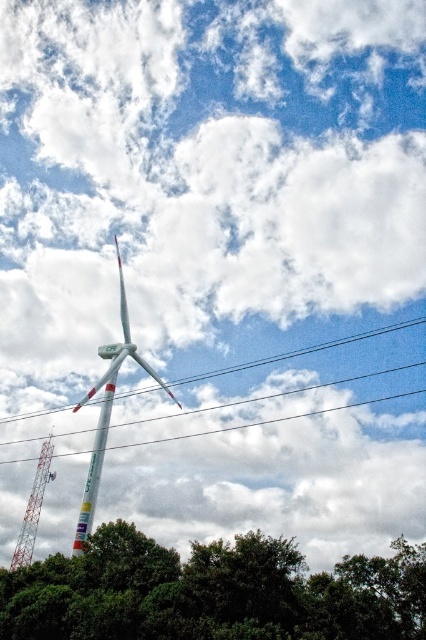
Can you confirm if white glossy wind turbine at center is positioned to the left of white painted metal windmill at left?

No, white glossy wind turbine at center is not to the left of white painted metal windmill at left.

Does white glossy wind turbine at center appear on the right side of white painted metal windmill at left?

Indeed, white glossy wind turbine at center is positioned on the right side of white painted metal windmill at left.

What do you see at coordinates (106, 412) in the screenshot? Image resolution: width=426 pixels, height=640 pixels. I see `white glossy wind turbine at center` at bounding box center [106, 412].

You are a GUI agent. You are given a task and a screenshot of the screen. Output one action in this format:
    pyautogui.click(x=<x>, y=<y>)
    Task: Click on the white glossy wind turbine at center
    The height and width of the screenshot is (640, 426).
    Given the screenshot: What is the action you would take?
    pyautogui.click(x=106, y=412)

Can you confirm if white plastic power line at center is wider than white painted metal wind turbine at center?

Yes, white plastic power line at center is wider than white painted metal wind turbine at center.

Where is `white plastic power line at center`? Image resolution: width=426 pixels, height=640 pixels. white plastic power line at center is located at coordinates (264, 396).

Does green leafy tree at lower center have a greater height compared to white glossy wind turbine at center?

No.

Who is taller, green leafy tree at lower center or white glossy wind turbine at center?

white glossy wind turbine at center is taller.

You are a GUI agent. You are given a task and a screenshot of the screen. Output one action in this format:
    pyautogui.click(x=<x>, y=<y>)
    Task: Click on the green leafy tree at lower center
    
    Given the screenshot: What is the action you would take?
    pyautogui.click(x=213, y=593)